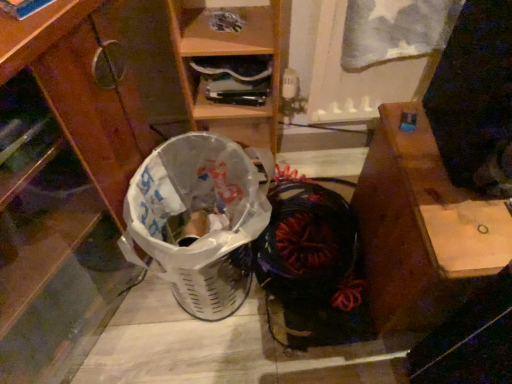
The width and height of the screenshot is (512, 384). What do you see at coordinates (434, 256) in the screenshot? I see `wooden desk at right` at bounding box center [434, 256].

Identify the location of wooden desk at right. The image size is (512, 384). (434, 256).

Looking at this image, is brushed wood cabinet at lower left facing away from black fabric shoe at center?

brushed wood cabinet at lower left does not have its back to black fabric shoe at center.

Is the surface of brushed wood cabinet at lower left in direct contact with black fabric shoe at center?

No, brushed wood cabinet at lower left is not making contact with black fabric shoe at center.

Considering the sizes of objects brushed wood cabinet at lower left and black fabric shoe at center in the image provided, who is shorter, brushed wood cabinet at lower left or black fabric shoe at center?

Standing shorter between the two is black fabric shoe at center.

Can you confirm if black fabric shoe at center is thinner than brushed wood cabinet at lower left?

Yes, black fabric shoe at center is thinner than brushed wood cabinet at lower left.

Does point (340, 321) appear closer or farther from the camera than point (92, 214)?

Point (340, 321).

Can you confirm if black fabric shoe at center is shorter than brushed wood cabinet at lower left?

Indeed, black fabric shoe at center has a lesser height compared to brushed wood cabinet at lower left.

Consider the image. Is black fabric shoe at center positioned behind brushed wood cabinet at lower left?

Yes, it is behind brushed wood cabinet at lower left.

Considering the positions of objects white plastic shopping basket at lower left and brushed wood cabinet at lower left in the image provided, who is more to the right, white plastic shopping basket at lower left or brushed wood cabinet at lower left?

white plastic shopping basket at lower left.

From the image's perspective, between white plastic shopping basket at lower left and brushed wood cabinet at lower left, who is located below?

white plastic shopping basket at lower left, from the image's perspective.

From a real-world perspective, who is located higher, white plastic shopping basket at lower left or brushed wood cabinet at lower left?

From a 3D spatial view, brushed wood cabinet at lower left is above.

Is there a large distance between white plastic shopping basket at lower left and brushed wood cabinet at lower left?

white plastic shopping basket at lower left is actually quite close to brushed wood cabinet at lower left.

Is point (355, 341) closer or farther from the camera than point (184, 247)?

Point (355, 341) is farther from the camera than point (184, 247).

Would you say black fabric shoe at center is outside white plastic shopping basket at lower left?

Yes, black fabric shoe at center is not within white plastic shopping basket at lower left.

Is black fabric shoe at center positioned with its back to white plastic shopping basket at lower left?

No, black fabric shoe at center is not facing away from white plastic shopping basket at lower left.

Looking at this image, can you confirm if black fabric shoe at center is taller than white plastic shopping basket at lower left?

No, black fabric shoe at center is not taller than white plastic shopping basket at lower left.

Is white plastic shopping basket at lower left turned away from black fabric shoe at center?

white plastic shopping basket at lower left does not have its back to black fabric shoe at center.

Is black fabric shoe at center located within white plastic shopping basket at lower left?

No, black fabric shoe at center is not inside white plastic shopping basket at lower left.

From a real-world perspective, between white plastic shopping basket at lower left and black fabric shoe at center, who is vertically lower?

From a 3D spatial view, black fabric shoe at center is below.

Which is closer to the camera, (177, 216) or (267, 281)?

Positioned in front is point (177, 216).

Can you tell me how much wooden desk at right and white plastic shopping basket at lower left differ in facing direction?

The facing directions of wooden desk at right and white plastic shopping basket at lower left are 33.5 degrees apart.

Is point (383, 283) positioned in front of point (237, 160)?

No, it is behind (237, 160).

Considering the sizes of objects wooden desk at right and white plastic shopping basket at lower left in the image provided, who is taller, wooden desk at right or white plastic shopping basket at lower left?

Standing taller between the two is wooden desk at right.

Which object is closer to the camera, wooden desk at right or white plastic shopping basket at lower left?

wooden desk at right.

Are wooden desk at right and brushed wood cabinet at lower left far apart?

No, wooden desk at right is in close proximity to brushed wood cabinet at lower left.

Between wooden desk at right and brushed wood cabinet at lower left, which one has smaller width?

wooden desk at right.

Between wooden desk at right and brushed wood cabinet at lower left, which one has less height?

Standing shorter between the two is wooden desk at right.

Identify the location of cabinetry in front of the black fabric shoe at center. Image resolution: width=512 pixels, height=384 pixels. (74, 171).

This screenshot has height=384, width=512. In the image, there is a black fabric shoe at center. Find the location of `cabinetry above it (from the image's perspective)`. cabinetry above it (from the image's perspective) is located at coordinates (74, 171).

Which object lies further to the anchor point white plastic shopping basket at lower left, black fabric shoe at center or wooden desk at right?

wooden desk at right lies further to white plastic shopping basket at lower left than the other object.

Based on their spatial positions, is brushed wood cabinet at lower left or white plastic shopping basket at lower left closer to wooden desk at right?

Based on the image, white plastic shopping basket at lower left appears to be nearer to wooden desk at right.

Looking at the image, which one is located further to black fabric shoe at center, brushed wood cabinet at lower left or white plastic shopping basket at lower left?

Based on the image, brushed wood cabinet at lower left appears to be further to black fabric shoe at center.

Based on their spatial positions, is brushed wood cabinet at lower left or black fabric shoe at center further from white plastic shopping basket at lower left?

black fabric shoe at center.

Based on their spatial positions, is black fabric shoe at center or white plastic shopping basket at lower left closer to brushed wood cabinet at lower left?

Based on the image, white plastic shopping basket at lower left appears to be nearer to brushed wood cabinet at lower left.

Considering their positions, is wooden desk at right positioned further to black fabric shoe at center than white plastic shopping basket at lower left?

Based on the image, white plastic shopping basket at lower left appears to be further to black fabric shoe at center.

Looking at the image, which one is located closer to white plastic shopping basket at lower left, wooden desk at right or black fabric shoe at center?

black fabric shoe at center lies closer to white plastic shopping basket at lower left than the other object.

From the image, which object appears to be nearer to brushed wood cabinet at lower left, wooden desk at right or black fabric shoe at center?

black fabric shoe at center is closer to brushed wood cabinet at lower left.

Locate an element on the screen. The image size is (512, 384). shopping basket between brushed wood cabinet at lower left and wooden desk at right is located at coordinates (198, 215).

This screenshot has width=512, height=384. Find the location of `footwear between brushed wood cabinet at lower left and wooden desk at right from left to right`. footwear between brushed wood cabinet at lower left and wooden desk at right from left to right is located at coordinates (312, 269).

The height and width of the screenshot is (384, 512). Identify the location of shopping basket situated between brushed wood cabinet at lower left and black fabric shoe at center from left to right. (198, 215).

This screenshot has width=512, height=384. Find the location of `footwear between white plastic shopping basket at lower left and wooden desk at right in the horizontal direction`. footwear between white plastic shopping basket at lower left and wooden desk at right in the horizontal direction is located at coordinates (312, 269).